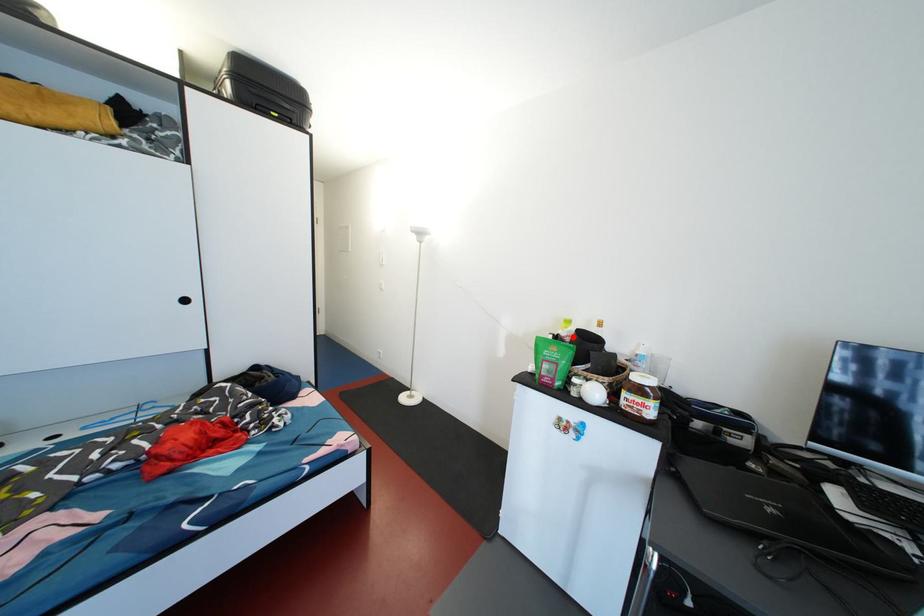
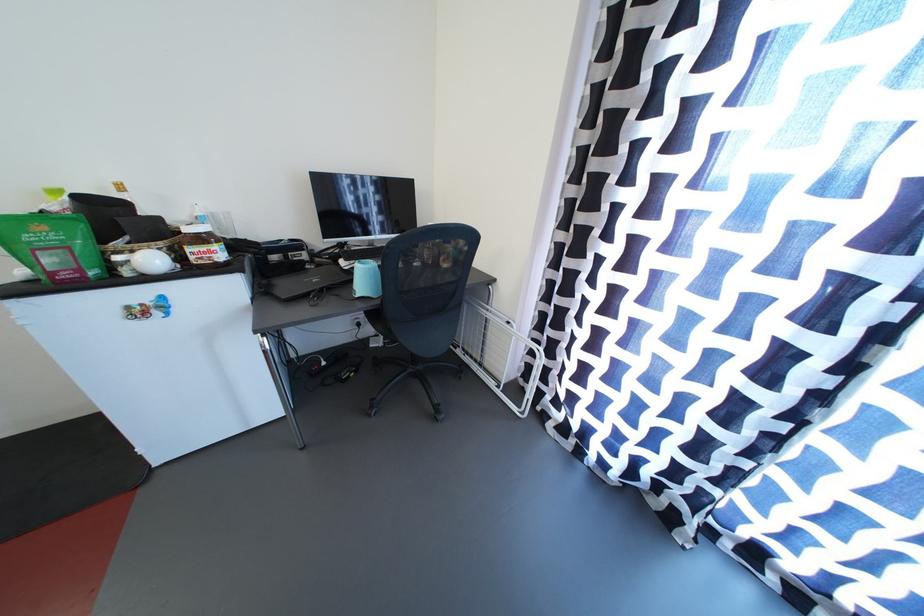
Find the pixel in the second image that matches the highlighted location in the first image.

(64, 209)